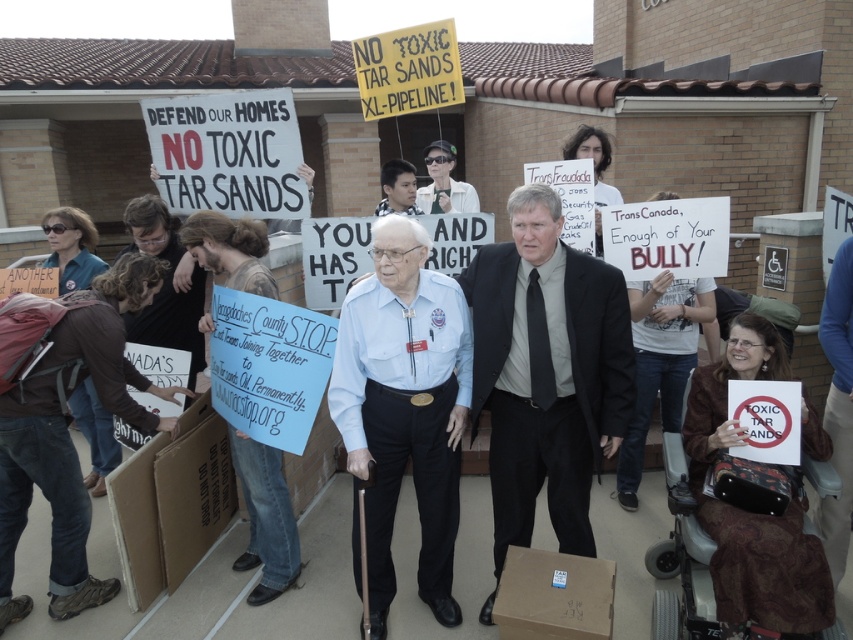
Question: Among these points, which one is nearest to the camera?

Choices:
 (A) (547, 561)
 (B) (547, 300)
 (C) (202, 541)
 (D) (448, 515)

Answer: (B)

Question: Which object is positioned farthest from the brown cardboard box at lower left?

Choices:
 (A) light blue uniform at center
 (B) brown cardboard box at lower center
 (C) black suit at center

Answer: (B)

Question: Is brown cardboard box at lower left in front of brown cardboard box at lower center?

Choices:
 (A) yes
 (B) no

Answer: (B)

Question: Is black suit at center bigger than brown cardboard box at lower left?

Choices:
 (A) yes
 (B) no

Answer: (A)

Question: Estimate the real-world distances between objects in this image. Which object is closer to the black suit at center?

Choices:
 (A) brown cardboard box at lower left
 (B) brown cardboard box at lower center

Answer: (B)

Question: Is light blue uniform at center to the right of brown cardboard box at lower center from the viewer's perspective?

Choices:
 (A) no
 (B) yes

Answer: (A)